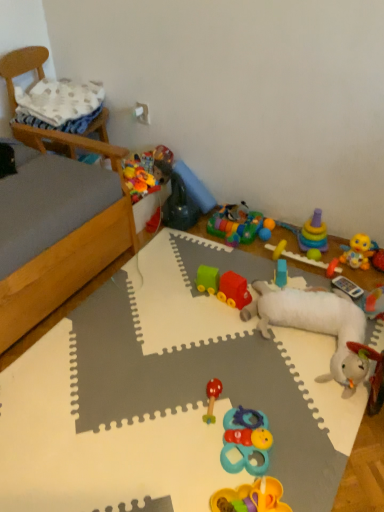
Identify the location of free location to the left of yellow rubber duck at right, the 3th toy from the top. The width and height of the screenshot is (384, 512). (320, 277).